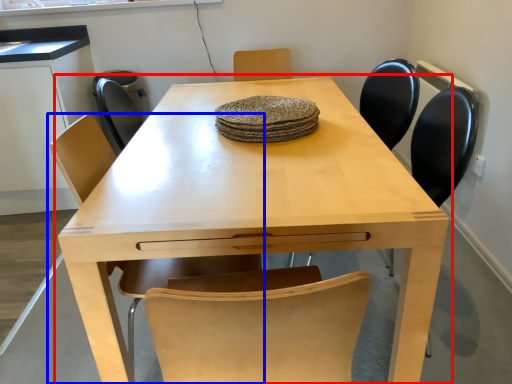
Question: Which of the following is the closest to the observer, table (highlighted by a red box) or chair (highlighted by a blue box)?

Choices:
 (A) table
 (B) chair

Answer: (A)